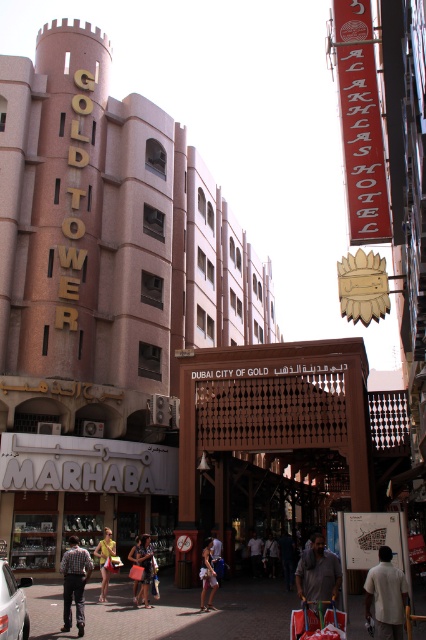
Does pink textured building at upper left appear on the right side of silver metallic car at lower left?

Correct, you'll find pink textured building at upper left to the right of silver metallic car at lower left.

Which is behind, point (127, 168) or point (25, 577)?

The point (127, 168) is behind.

Where is `pink textured building at upper left`? Image resolution: width=426 pixels, height=640 pixels. pink textured building at upper left is located at coordinates (109, 250).

Between silver metallic car at lower left and denim shorts at center, which one has less height?

With less height is silver metallic car at lower left.

Which is in front, point (25, 602) or point (144, 548)?

Point (25, 602) is more forward.

The image size is (426, 640). Identify the location of silver metallic car at lower left. (13, 604).

How much distance is there between white matte shirt at lower right and dark blue shirt at center?

white matte shirt at lower right is 31.74 meters from dark blue shirt at center.

Is point (371, 566) behind point (273, 541)?

No, it is in front of (273, 541).

Does point (382, 579) come farther from viewer compared to point (270, 547)?

No.

The width and height of the screenshot is (426, 640). I want to click on white matte shirt at lower right, so pos(385,595).